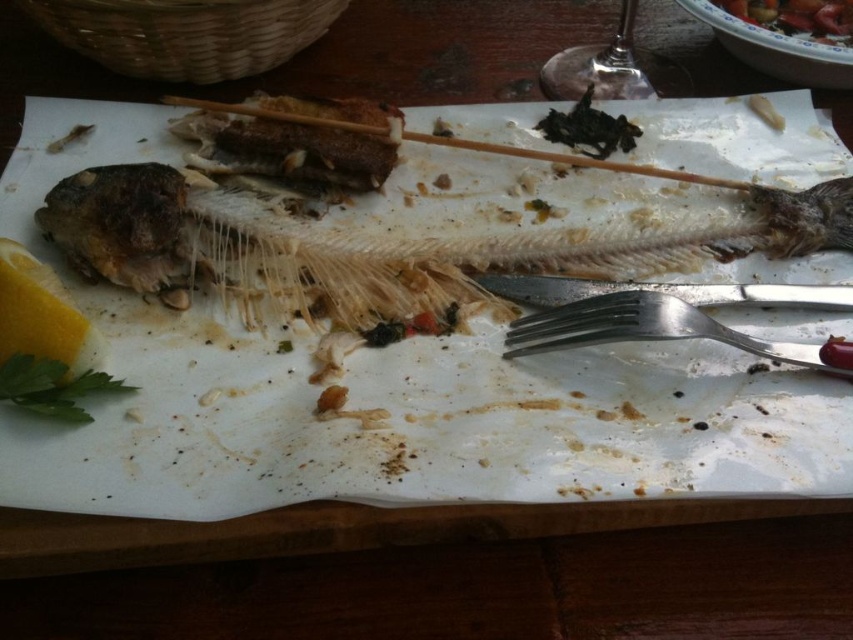
You are a food critic evaluating the presentation of this dish. The yellow matte lemon at lower left and the transparent glass at upper center are both part of the dish. Which one has a smaller width?

The yellow matte lemon at lower left is thinner than the transparent glass at upper center, so the yellow matte lemon at lower left has a smaller width.

You are a food critic evaluating the presentation of this dish. You notice the yellow matte lemon at lower left and the green leafy parsley at lower left. Which garnish is positioned closer to the edge of the wooden board?

The yellow matte lemon at lower left might be wider than green leafy parsley at lower left, but their positions relative to the edge of the wooden board are not specified in the provided description. Therefore, the description does not provide enough information to determine which garnish is closer to the edge.

You are a diner who just finished eating and wants to place your silverware properly. You see the silver metallic fork at lower right and the green leafy parsley at lower left. Which object is located higher on the plate?

The silver metallic fork at lower right is above the green leafy parsley at lower left, so the silver metallic fork at lower right is higher on the plate.